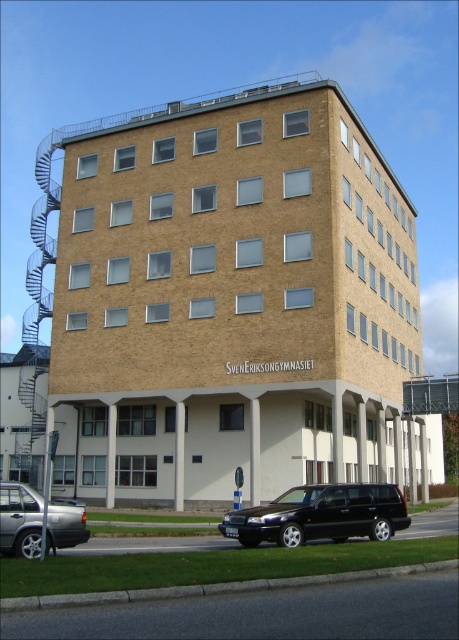
You are a delivery driver approaching the building and need to park your vehicle. You see a black metallic car at lower center and a silver metallic sedan at lower left. Which parking spot is closer to the entrance of the building?

The silver metallic sedan at lower left is closer to the entrance of the building because it is positioned to the left of the black metallic car at lower center, which is further to the right.

You are a delivery driver who needs to park your vehicle in the parking lot near the building. You have a truck that is 1.8 meters tall. Can you safely park your truck between the black metallic car at lower center and the silver metallic sedan at lower left without hitting the roof?

The black metallic car at lower center is taller than the silver metallic sedan at lower left. Since the truck is 1.8 meters tall, and the black metallic car is taller than the sedan, it is possible that the truck may not fit if the available space is constrained by the height of the taller vehicle. However, without specific height measurements of the parking space, it is difficult to determine definitively. Please check the maximum height allowance for the parking area before proceeding.